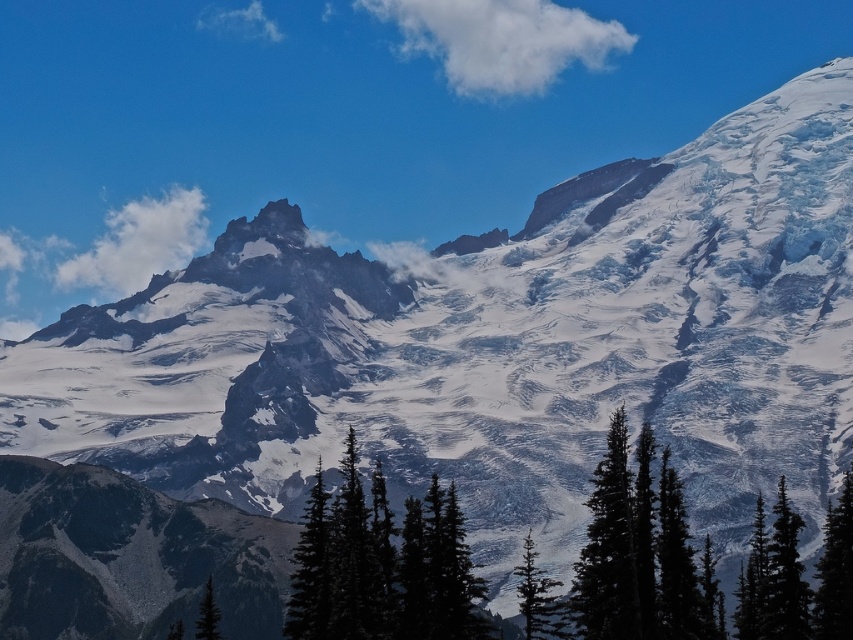
Question: Does green matte tree at lower center appear under green matte tree at lower right?

Choices:
 (A) no
 (B) yes

Answer: (B)

Question: Does white fluffy cloud at upper center have a greater width compared to green matte tree at center?

Choices:
 (A) yes
 (B) no

Answer: (A)

Question: Estimate the real-world distances between objects in this image. Which object is closer to the white fluffy cloud at upper center?

Choices:
 (A) green matte tree at lower center
 (B) green matte tree at center

Answer: (B)

Question: Among these objects, which one is farthest from the camera?

Choices:
 (A) green matte tree at lower center
 (B) green matte tree at center

Answer: (B)

Question: Which point appears closest to the camera in this image?

Choices:
 (A) (540, 636)
 (B) (193, 241)

Answer: (A)

Question: Is green matte tree at lower center above green matte tree at center?

Choices:
 (A) yes
 (B) no

Answer: (A)